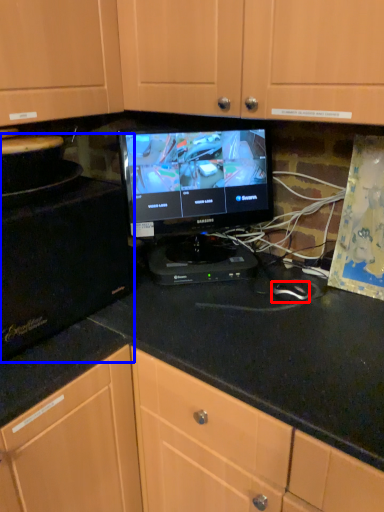
Question: Which of the following is the farthest to the observer, mouse (highlighted by a red box) or appliance (highlighted by a blue box)?

Choices:
 (A) mouse
 (B) appliance

Answer: (A)